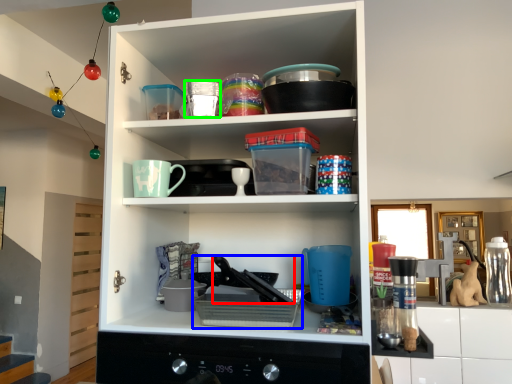
Question: Which object is the farthest from appliance (highlighted by a red box)? Choose among these: appliance (highlighted by a blue box) or tableware (highlighted by a green box).

Choices:
 (A) appliance
 (B) tableware

Answer: (B)